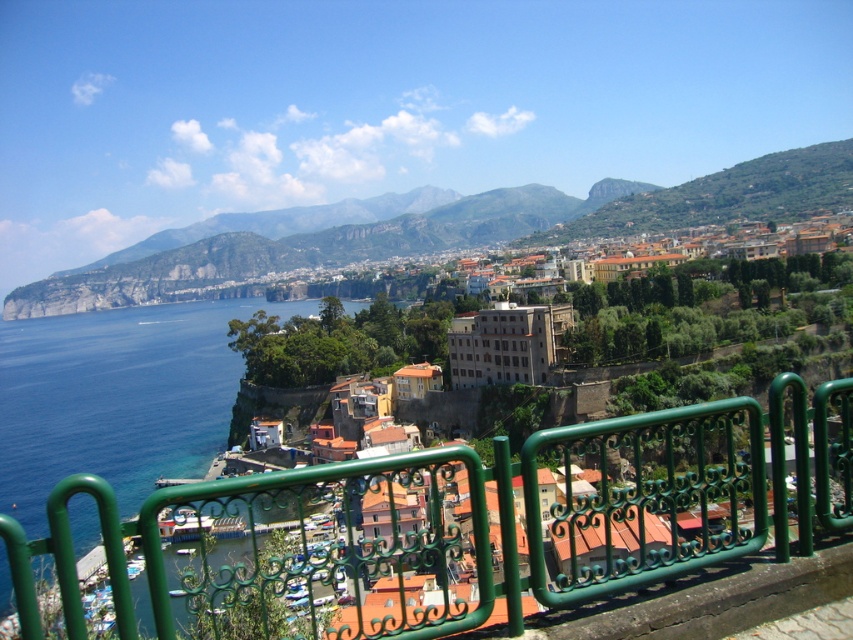
You are standing at the viewpoint overlooking the coastal town. There is a green wrought iron fence at center. Can you tell me what object is located exactly at the coordinates point (471, 522)?

The point (471, 522) corresponds to the green wrought iron fence at center.

You are standing on a balcony overlooking a coastal town. You see the green wrought iron fence at center and the blue water at lower left. Which object is closer to you?

The green wrought iron fence at center is closer to you since it is in front of the blue water at lower left.